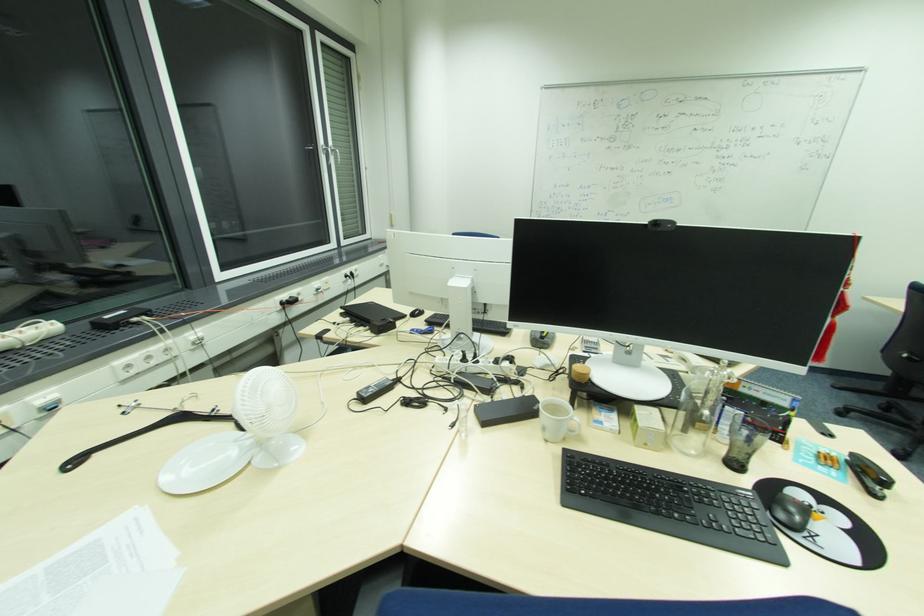
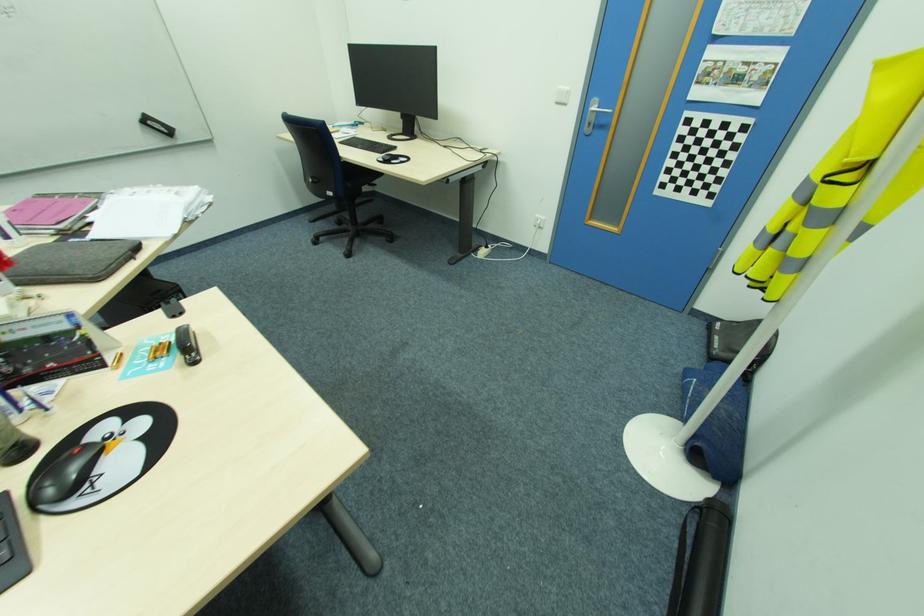
Find the pixel in the second image that matches [784,515] in the first image.

(54, 490)